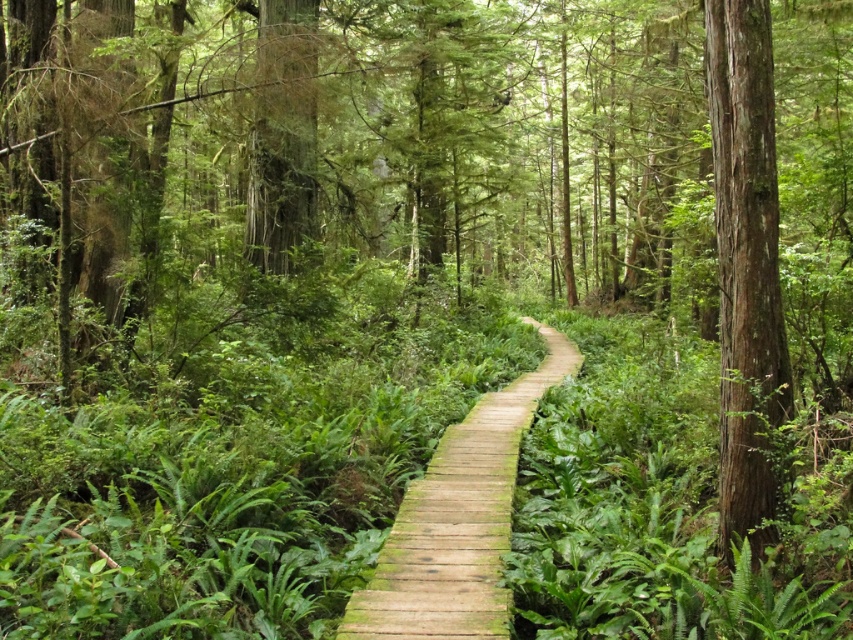
Question: Can you confirm if smooth brown tree trunk at right is smaller than wooden planks at center?

Choices:
 (A) yes
 (B) no

Answer: (A)

Question: Does smooth brown tree trunk at right appear under wooden planks at center?

Choices:
 (A) yes
 (B) no

Answer: (B)

Question: Can you confirm if smooth brown tree trunk at right is wider than wooden planks at center?

Choices:
 (A) no
 (B) yes

Answer: (A)

Question: Among these points, which one is farthest from the camera?

Choices:
 (A) (735, 58)
 (B) (431, 624)

Answer: (A)